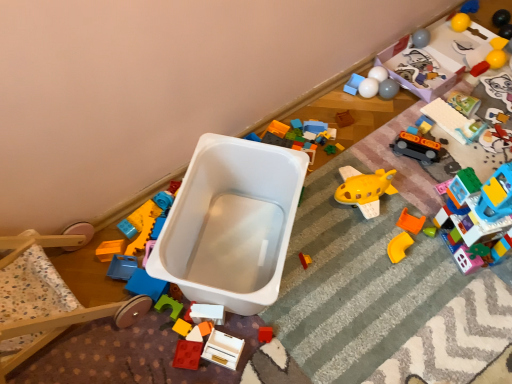
Image resolution: width=512 pixels, height=384 pixels. I want to click on free space to the left of matte gray cat at upper right, which is the fifteenth toy in left-to-right order, so [x=468, y=94].